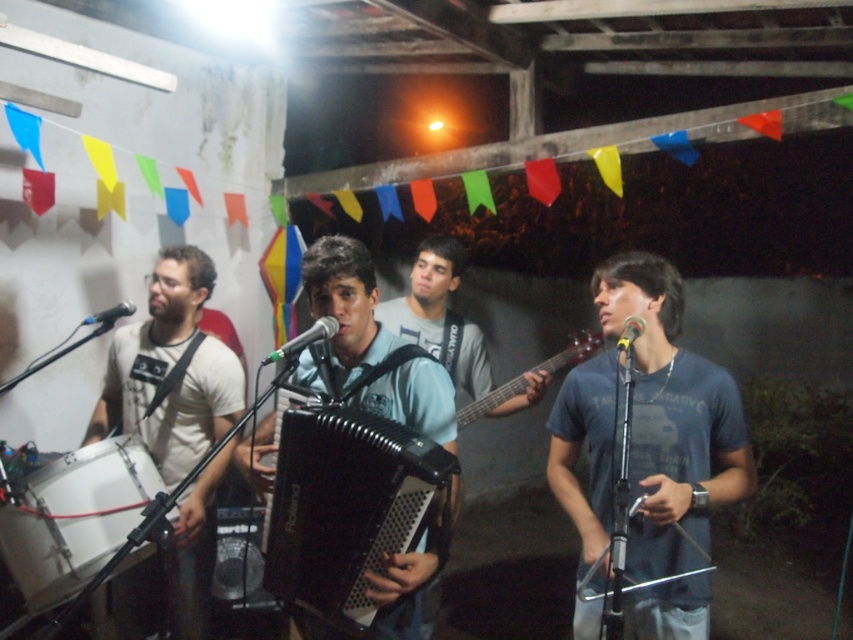
Does black plastic accordion at center have a larger size compared to white matte t-shirt at left?

Actually, black plastic accordion at center might be smaller than white matte t-shirt at left.

Can you confirm if black plastic accordion at center is smaller than white matte t-shirt at left?

Correct, black plastic accordion at center occupies less space than white matte t-shirt at left.

Find the location of a particular element. black plastic accordion at center is located at coordinates (347, 512).

Locate an element on the screen. black plastic accordion at center is located at coordinates (347, 512).

Is black plastic accordion at center to the left of white drum at lower left from the viewer's perspective?

No, black plastic accordion at center is not to the left of white drum at lower left.

Who is more distant from viewer, [317,436] or [73,552]?

The point [73,552] is behind.

Which is behind, point (294, 561) or point (44, 497)?

Positioned behind is point (44, 497).

Where is `black plastic accordion at center`? The image size is (853, 640). black plastic accordion at center is located at coordinates (347, 512).

Who is positioned more to the right, white matte t-shirt at left or white drum at lower left?

white matte t-shirt at left

Between white matte t-shirt at left and white drum at lower left, which one is positioned lower?

white drum at lower left

At what (x,y) coordinates should I click in order to perform the action: click on white matte t-shirt at left. Please return your answer as a coordinate pair (x, y). This screenshot has width=853, height=640. Looking at the image, I should click on (171, 371).